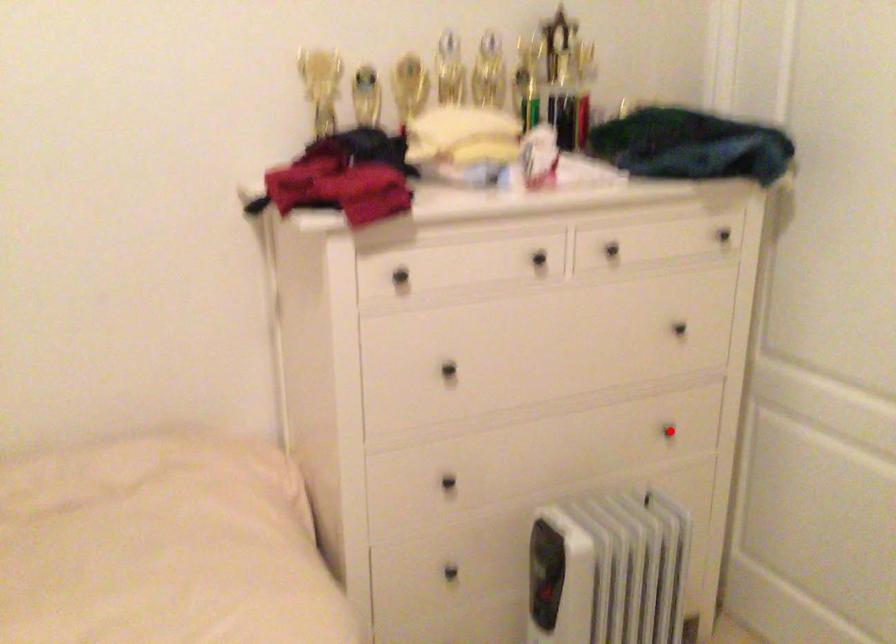
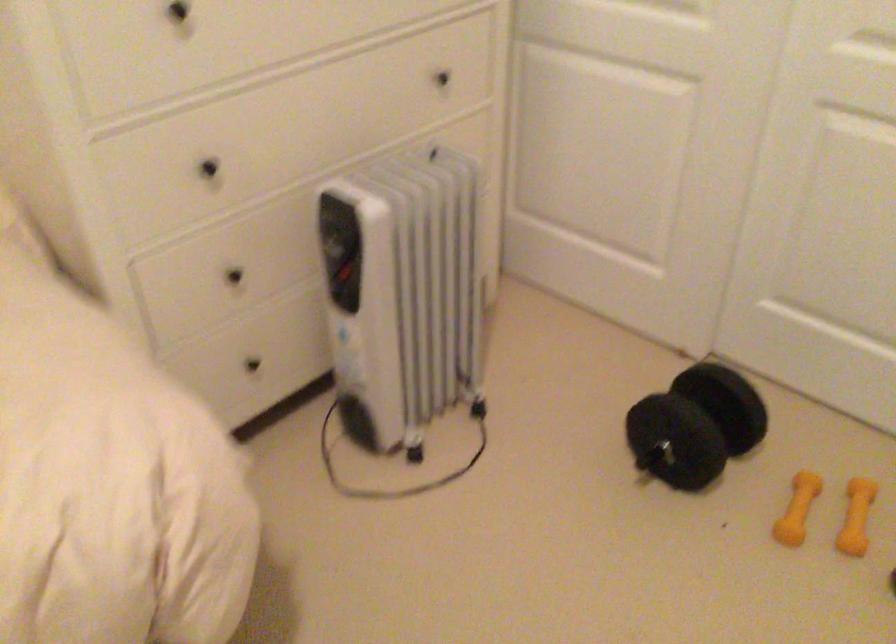
The point at the highlighted location is marked in the first image. Where is the corresponding point in the second image?

(442, 79)